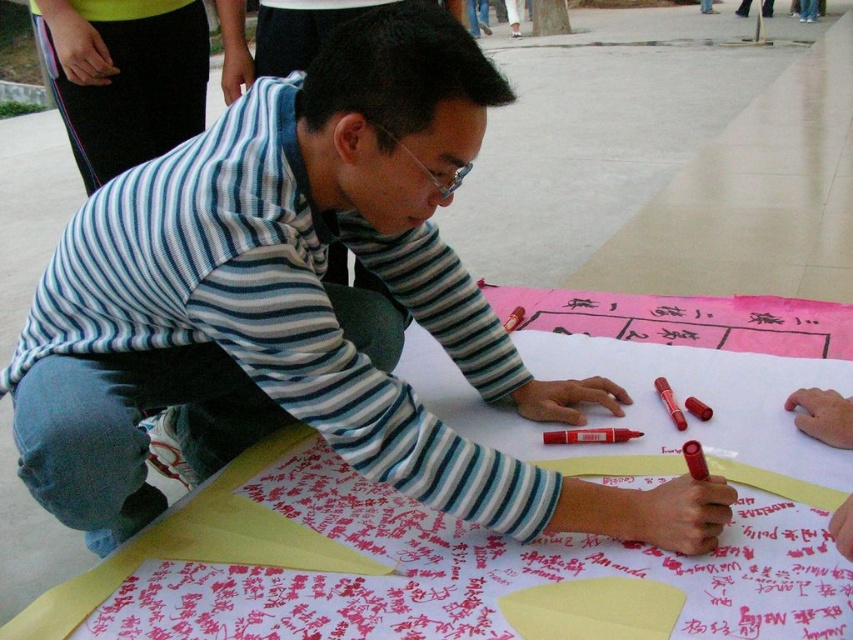
You are an artist who needs to choose between the red matte marker at center and the matte red marker at center for a detailed sketch. Which marker should you pick if you want the one with a smaller tip?

The red matte marker at center is smaller than the matte red marker at center, so you should pick the red matte marker at center for a detailed sketch with a smaller tip.

In the scene shown: You are trying to organize the markers on the table. Which marker, the red matte marker at center or the matte red marker at center, is located below the other?

The red matte marker at center is positioned under the matte red marker at center, so it is located below the other.

You are trying to pick up the red matte marker at center and the matte red marker at center from the table. Which one would you reach first if you approach the table from the front?

The red matte marker at center is closer to the viewer than the matte red marker at center, so you would reach it first.